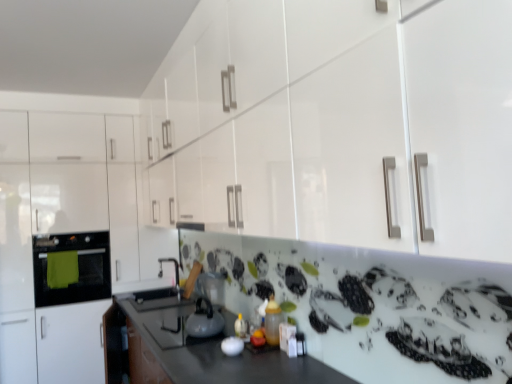
Question: Can you confirm if matte black oven at left is smaller than white glossy cabinet at left?

Choices:
 (A) no
 (B) yes

Answer: (B)

Question: Is matte black oven at left not within white glossy cabinet at left?

Choices:
 (A) no
 (B) yes

Answer: (A)

Question: Does matte black oven at left have a greater width compared to white glossy cabinet at left?

Choices:
 (A) no
 (B) yes

Answer: (A)

Question: Considering the relative sizes of matte black oven at left and white glossy cabinet at left in the image provided, is matte black oven at left shorter than white glossy cabinet at left?

Choices:
 (A) yes
 (B) no

Answer: (A)

Question: Does matte black oven at left lie in front of white glossy cabinet at left?

Choices:
 (A) yes
 (B) no

Answer: (B)

Question: Based on their positions, is white glossy kettle at center, positioned as the first appliance in front-to-back order, located to the left or right of satin silver kettle at center, which appears as the second appliance when viewed from the front?

Choices:
 (A) right
 (B) left

Answer: (A)

Question: Which is correct: white glossy kettle at center, the 2th appliance from the left, is inside satin silver kettle at center, placed as the 1th appliance when sorted from back to front, or outside of it?

Choices:
 (A) inside
 (B) outside

Answer: (B)

Question: From a real-world perspective, is white glossy kettle at center, positioned as the first appliance in front-to-back order, physically located above or below satin silver kettle at center, which appears as the second appliance when viewed from the front?

Choices:
 (A) above
 (B) below

Answer: (B)

Question: Looking at their shapes, would you say white glossy kettle at center, positioned as the first appliance in front-to-back order, is wider or thinner than satin silver kettle at center, which is the second appliance in right-to-left order?

Choices:
 (A) wide
 (B) thin

Answer: (B)

Question: From the image's perspective, is white glossy cabinet at left above or below matte black oven at left?

Choices:
 (A) above
 (B) below

Answer: (A)

Question: Is white glossy cabinet at left wider or thinner than matte black oven at left?

Choices:
 (A) wide
 (B) thin

Answer: (A)

Question: Is white glossy cabinet at left taller or shorter than matte black oven at left?

Choices:
 (A) tall
 (B) short

Answer: (A)

Question: From a real-world perspective, relative to matte black oven at left, is white glossy cabinet at left vertically above or below?

Choices:
 (A) below
 (B) above

Answer: (B)

Question: From a real-world perspective, is white glossy kettle at center, positioned as the 1th appliance in right-to-left order, positioned above or below matte black oven at left?

Choices:
 (A) above
 (B) below

Answer: (B)

Question: Based on their positions, is white glossy kettle at center, positioned as the 1th appliance in right-to-left order, located to the left or right of matte black oven at left?

Choices:
 (A) right
 (B) left

Answer: (A)